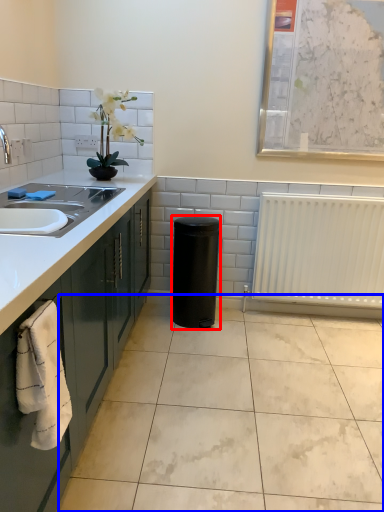
Question: Which of the following is the closest to the observer, appliance (highlighted by a red box) or ceramic tile (highlighted by a blue box)?

Choices:
 (A) appliance
 (B) ceramic tile

Answer: (B)